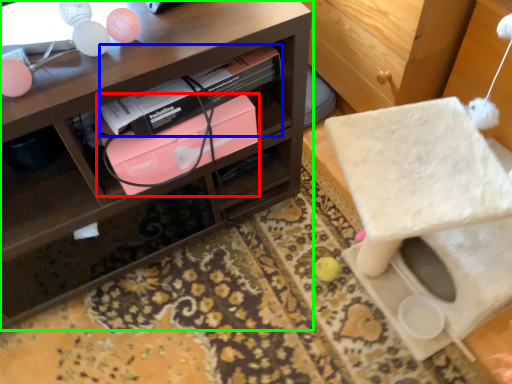
Question: Which object is the farthest from box (highlighted by a red box)? Choose among these: book (highlighted by a blue box) or shelf (highlighted by a green box).

Choices:
 (A) book
 (B) shelf

Answer: (B)